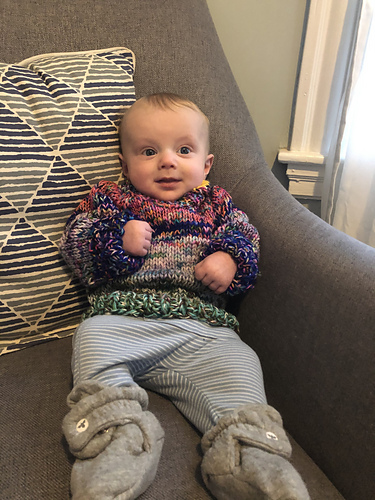
I want to click on white space by window, so click(314, 85).